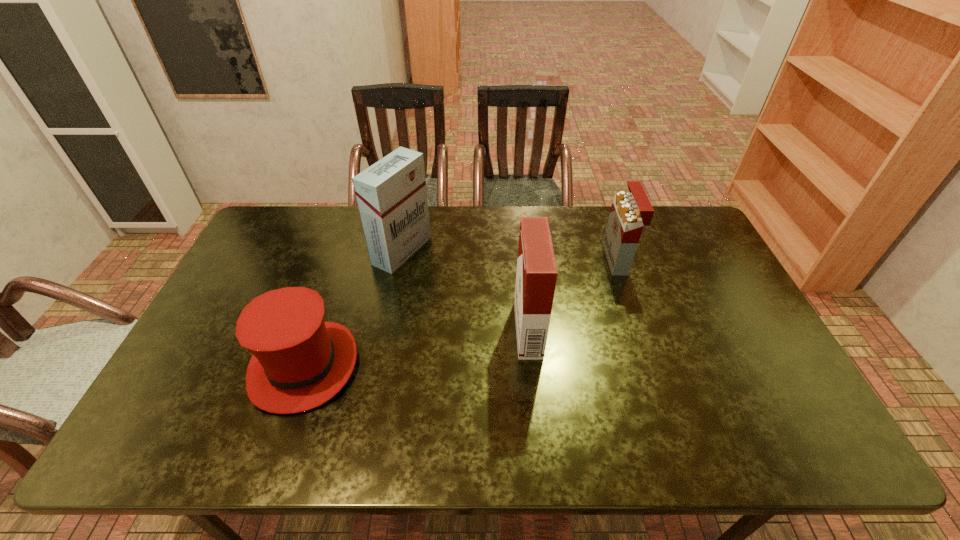
Where is `vacant region located 0.280m with the lid open on the third tallest object`? The width and height of the screenshot is (960, 540). vacant region located 0.280m with the lid open on the third tallest object is located at coordinates (522, 259).

I want to click on vacant space located with the lid open on the third tallest object, so click(525, 259).

Where is `vacant point located 0.340m with the lid open on the third tallest object`? The image size is (960, 540). vacant point located 0.340m with the lid open on the third tallest object is located at coordinates (504, 259).

The image size is (960, 540). Identify the location of vacant region located on the left of the shortest object. (229, 366).

Identify the location of vacant region at the far edge of the desktop. (477, 214).

Find the location of a particular element. The width and height of the screenshot is (960, 540). free point at the near edge is located at coordinates pyautogui.click(x=294, y=450).

The image size is (960, 540). Find the location of `vacant area at the left edge`. vacant area at the left edge is located at coordinates (241, 269).

At what (x,y) coordinates should I click in order to perform the action: click on vacant space at the right edge. Please return your answer as a coordinate pair (x, y). The width and height of the screenshot is (960, 540). Looking at the image, I should click on (756, 327).

Locate an element on the screen. The image size is (960, 540). free point at the far left corner is located at coordinates (261, 246).

This screenshot has height=540, width=960. I want to click on empty space that is in between the hat and the shortest cigarette case, so (x=461, y=313).